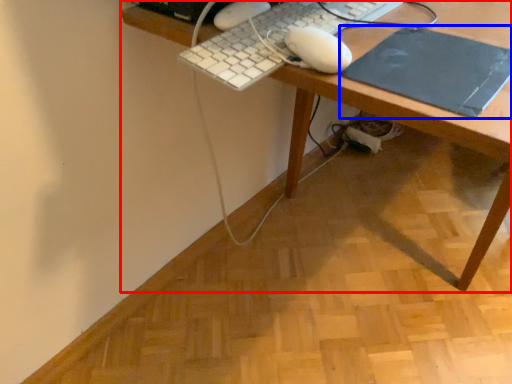
Question: Which object is further to the camera taking this photo, desk (highlighted by a red box) or mousepad (highlighted by a blue box)?

Choices:
 (A) desk
 (B) mousepad

Answer: (B)